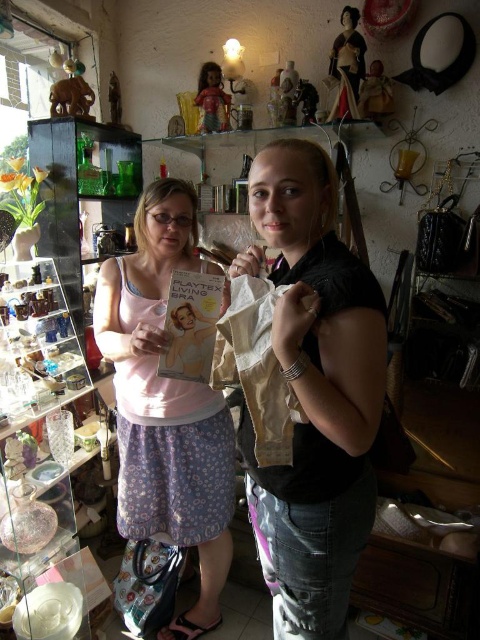
Between point (129, 461) and point (204, 81), which one is positioned in front?

Point (129, 461)

Which is in front, point (120, 440) or point (200, 106)?

Positioned in front is point (120, 440).

Locate an element on the screen. The image size is (480, 640). pink fabric bra at left is located at coordinates tap(166, 404).

Is porcelain figurine at upper center positioned in front of wooden figurine at upper right?

Yes.

Looking at this image, which is more to the right, porcelain figurine at upper center or wooden figurine at upper right?

wooden figurine at upper right

Measure the distance between point (355, 19) and camera.

Point (355, 19) and camera are 2.12 meters apart from each other.

This screenshot has height=640, width=480. What are the coordinates of `porcelain figurine at upper center` in the screenshot? It's located at (347, 65).

Which is above, matte beige lingerie at center or matte brown figurine at upper left?

matte brown figurine at upper left

Is point (346, 636) in front of point (76, 67)?

Yes, it is.

Describe the element at coordinates (314, 396) in the screenshot. Image resolution: width=480 pixels, height=640 pixels. I see `matte beige lingerie at center` at that location.

You are a GUI agent. You are given a task and a screenshot of the screen. Output one action in this format:
    pyautogui.click(x=<x>, y=<y>)
    Task: Click on the matte beige lingerie at center
    The image size is (480, 640).
    Given the screenshot: What is the action you would take?
    pyautogui.click(x=314, y=396)